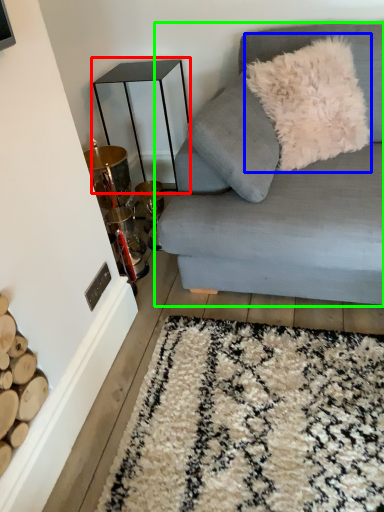
Question: Based on their relative distances, which object is nearer to table (highlighted by a red box)? Choose from throw pillow (highlighted by a blue box) and studio couch (highlighted by a green box).

Choices:
 (A) throw pillow
 (B) studio couch

Answer: (A)